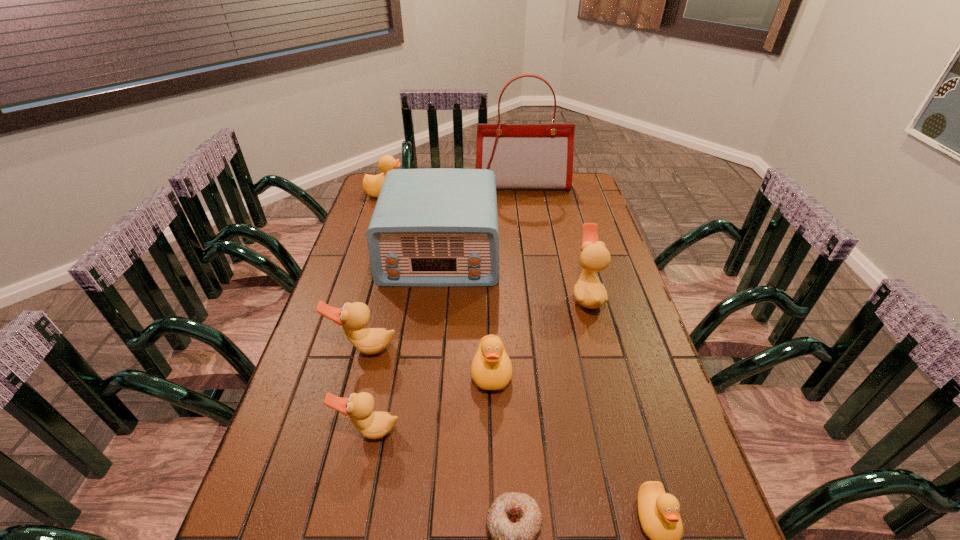
I want to click on the tallest object, so click(x=522, y=156).

Where is `handbag`? The width and height of the screenshot is (960, 540). handbag is located at coordinates (522, 156).

Find the location of a particular element. This screenshot has width=960, height=540. radio receiver is located at coordinates (438, 227).

The width and height of the screenshot is (960, 540). I want to click on the seventh shortest object, so click(588, 291).

Where is `the rightmost tan duck`? This screenshot has height=540, width=960. the rightmost tan duck is located at coordinates (588, 291).

Locate an element on the screen. The height and width of the screenshot is (540, 960). the biggest yellow duck is located at coordinates (372, 184).

Where is `the farthest duck`? Image resolution: width=960 pixels, height=540 pixels. the farthest duck is located at coordinates (372, 184).

At what (x,y) coordinates should I click in order to perform the action: click on the second biggest tan duck. Please return your answer as a coordinate pair (x, y). This screenshot has width=960, height=540. Looking at the image, I should click on (353, 317).

Locate an element on the screen. This screenshot has width=960, height=540. the second yellow duck from right to left is located at coordinates (491, 369).

Find the location of a particular element. the second smallest yellow duck is located at coordinates (491, 369).